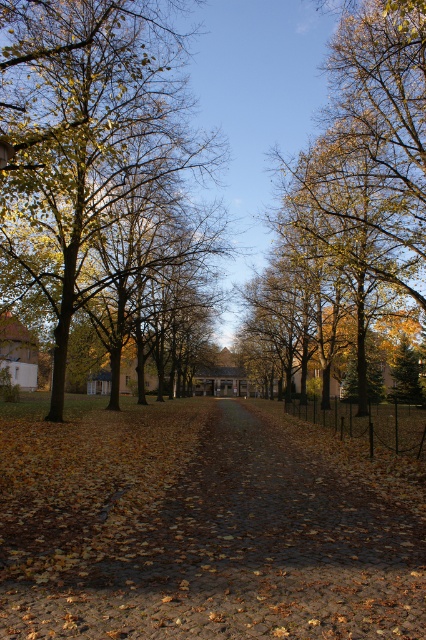
You are a gardener who wants to place a small decorative stone on the ground. You see the brown cobblestone path at center and the golden yellow leaves at center. Which surface is lower, so the stone won

The brown cobblestone path at center is lower than the golden yellow leaves at center, so placing the stone there would keep it at the lower level.

You are a photographer standing at the start of the brown cobblestone path at center and want to capture the golden yellow leaves at center in your shot. Since you can only focus on one object at a time, which object should you focus on first to ensure it appears sharp in the photo?

You should focus on the brown cobblestone path at center first because it is closer to the viewer than the golden yellow leaves at center, so focusing on the closer object ensures it will be sharp while the background may be slightly blurred.